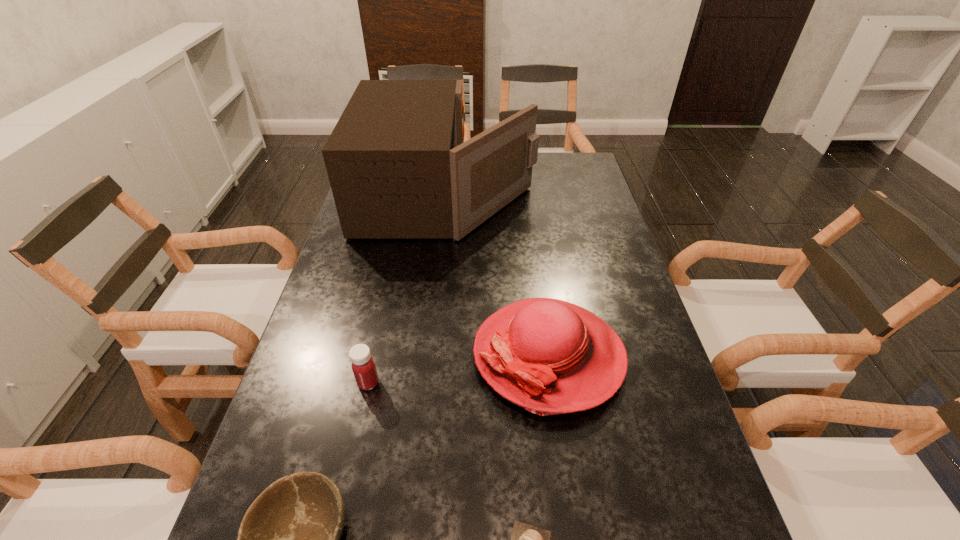
Find the location of a particular element. object that stands as the fourth closest to the second shortest object is located at coordinates (398, 166).

Locate an element on the screen. The width and height of the screenshot is (960, 540). the fourth closest object to the hat is located at coordinates coord(398,166).